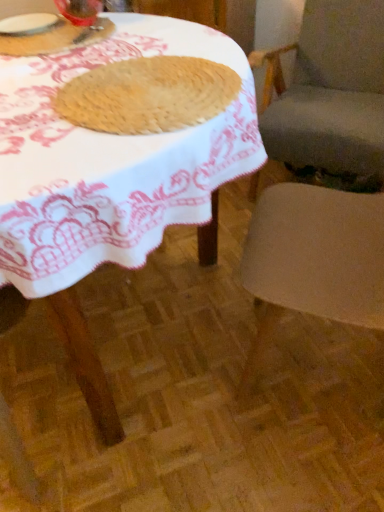
At what (x,y) coordinates should I click in order to perform the action: click on free space between white glossy plate at upper left, marked as the second tableware in a right-to-left arrangement, and golden brown textured cookie at center. Please return your answer as a coordinate pair (x, y). Looking at the image, I should click on (79, 56).